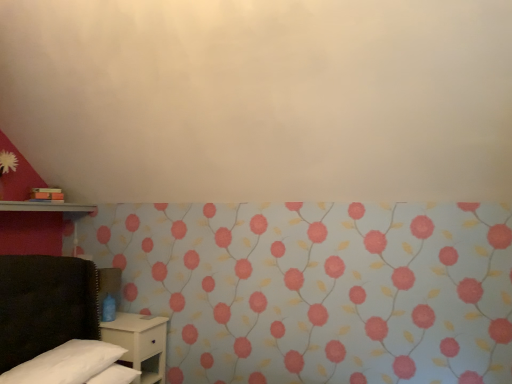
The width and height of the screenshot is (512, 384). What do you see at coordinates (46, 206) in the screenshot? I see `metallic silver shelf at left` at bounding box center [46, 206].

Find the location of `white matte nightstand at lower left`. white matte nightstand at lower left is located at coordinates (140, 343).

What do you see at coordinates (318, 289) in the screenshot?
I see `floral wallpaper at lower left` at bounding box center [318, 289].

This screenshot has height=384, width=512. What are the coordinates of `metallic silver shelf at left` in the screenshot? It's located at (46, 206).

In terms of width, does floral wallpaper at lower left look wider or thinner when compared to white matte nightstand at lower left?

floral wallpaper at lower left is wider than white matte nightstand at lower left.

In terms of size, does floral wallpaper at lower left appear bigger or smaller than white matte nightstand at lower left?

floral wallpaper at lower left is bigger than white matte nightstand at lower left.

Considering their positions, is floral wallpaper at lower left located in front of or behind white matte nightstand at lower left?

Clearly, floral wallpaper at lower left is in front of white matte nightstand at lower left.

From the image's perspective, relative to white matte nightstand at lower left, is white soft pillow at lower left above or below?

Based on their image positions, white soft pillow at lower left is located above white matte nightstand at lower left.

What's the angular difference between white soft pillow at lower left and white matte nightstand at lower left's facing directions?

3.6 degrees separate the facing orientations of white soft pillow at lower left and white matte nightstand at lower left.

Does point (117, 349) come closer to viewer compared to point (133, 333)?

Yes, it is in front of point (133, 333).

From a real-world perspective, does white matte nightstand at lower left sit lower than floral wallpaper at lower left?

Yes, from a real-world perspective, white matte nightstand at lower left is under floral wallpaper at lower left.

From the picture: Is white matte nightstand at lower left taller or shorter than floral wallpaper at lower left?

Clearly, white matte nightstand at lower left is shorter compared to floral wallpaper at lower left.

In the image, is white matte nightstand at lower left on the left side or the right side of floral wallpaper at lower left?

Clearly, white matte nightstand at lower left is on the left of floral wallpaper at lower left in the image.

Who is smaller, white matte nightstand at lower left or floral wallpaper at lower left?

With smaller size is white matte nightstand at lower left.

Considering the positions of objects metallic silver shelf at left and white soft pillow at lower left in the image provided, who is behind, metallic silver shelf at left or white soft pillow at lower left?

metallic silver shelf at left is behind.

At what (x,y) coordinates should I click in order to perform the action: click on pillow in front of the metallic silver shelf at left. Please return your answer as a coordinate pair (x, y). Image resolution: width=512 pixels, height=384 pixels. Looking at the image, I should click on (65, 364).

Could white soft pillow at lower left be considered to be inside metallic silver shelf at left?

No, white soft pillow at lower left is located outside of metallic silver shelf at left.

Which of these two, metallic silver shelf at left or white soft pillow at lower left, is bigger?

white soft pillow at lower left.

Find the location of a particular element. nightstand to the right of metallic silver shelf at left is located at coordinates (140, 343).

Between metallic silver shelf at left and white matte nightstand at lower left, which one has less height?

Standing shorter between the two is metallic silver shelf at left.

Is metallic silver shelf at left far away from white matte nightstand at lower left?

metallic silver shelf at left is positioned a significant distance from white matte nightstand at lower left.

Does metallic silver shelf at left have a smaller size compared to white matte nightstand at lower left?

Yes, metallic silver shelf at left is smaller than white matte nightstand at lower left.

Which is in front, point (147, 362) or point (95, 357)?

The point (95, 357) is closer to the camera.

Locate an element on the screen. This screenshot has width=512, height=384. pillow lying on the left of white matte nightstand at lower left is located at coordinates (65, 364).

From the image's perspective, is white matte nightstand at lower left under white soft pillow at lower left?

Yes, from the image's perspective, white matte nightstand at lower left is beneath white soft pillow at lower left.

In terms of height, does white soft pillow at lower left look taller or shorter compared to floral wallpaper at lower left?

Clearly, white soft pillow at lower left is shorter compared to floral wallpaper at lower left.

Considering the positions of objects white soft pillow at lower left and floral wallpaper at lower left in the image provided, who is more to the left, white soft pillow at lower left or floral wallpaper at lower left?

white soft pillow at lower left.

You are a GUI agent. You are given a task and a screenshot of the screen. Output one action in this format:
    pyautogui.click(x=<x>, y=<y>)
    Task: Click on the curtain above the white soft pillow at lower left (from a real-world perspective)
    The height and width of the screenshot is (384, 512).
    Given the screenshot: What is the action you would take?
    pyautogui.click(x=318, y=289)

Image resolution: width=512 pixels, height=384 pixels. What are the coordinates of `nightstand that appears behind the floral wallpaper at lower left` in the screenshot? It's located at (140, 343).

Identify the location of pillow that appears in front of the white matte nightstand at lower left. This screenshot has height=384, width=512. point(65,364).

Considering their positions, is white soft pillow at lower left positioned closer to white matte nightstand at lower left than metallic silver shelf at left?

Based on the image, white soft pillow at lower left appears to be nearer to white matte nightstand at lower left.

Considering their positions, is white matte nightstand at lower left positioned further to white soft pillow at lower left than metallic silver shelf at left?

metallic silver shelf at left is positioned further to the anchor white soft pillow at lower left.

Estimate the real-world distances between objects in this image. Which object is further from floral wallpaper at lower left, white soft pillow at lower left or white matte nightstand at lower left?

white soft pillow at lower left is further to floral wallpaper at lower left.

From the image, which object appears to be nearer to white soft pillow at lower left, metallic silver shelf at left or floral wallpaper at lower left?

floral wallpaper at lower left is closer to white soft pillow at lower left.

In the scene shown: When comparing their distances from metallic silver shelf at left, does white matte nightstand at lower left or floral wallpaper at lower left seem further?

Based on the image, floral wallpaper at lower left appears to be further to metallic silver shelf at left.

Considering their positions, is white soft pillow at lower left positioned closer to white matte nightstand at lower left than floral wallpaper at lower left?

white soft pillow at lower left is closer to white matte nightstand at lower left.

When comparing their distances from floral wallpaper at lower left, does metallic silver shelf at left or white matte nightstand at lower left seem closer?

white matte nightstand at lower left.

Based on their spatial positions, is metallic silver shelf at left or white matte nightstand at lower left closer to white soft pillow at lower left?

The object closer to white soft pillow at lower left is white matte nightstand at lower left.

Where is `pillow positioned between floral wallpaper at lower left and white matte nightstand at lower left from near to far`? pillow positioned between floral wallpaper at lower left and white matte nightstand at lower left from near to far is located at coordinates point(65,364).

Locate an element on the screen. The height and width of the screenshot is (384, 512). pillow between metallic silver shelf at left and white matte nightstand at lower left in the up-down direction is located at coordinates (65, 364).

At what (x,y) coordinates should I click in order to perform the action: click on shelf between floral wallpaper at lower left and white matte nightstand at lower left in the front-back direction. Please return your answer as a coordinate pair (x, y). The image size is (512, 384). Looking at the image, I should click on (46, 206).

Where is `pillow located between floral wallpaper at lower left and metallic silver shelf at left in the depth direction`? The height and width of the screenshot is (384, 512). pillow located between floral wallpaper at lower left and metallic silver shelf at left in the depth direction is located at coordinates pos(65,364).